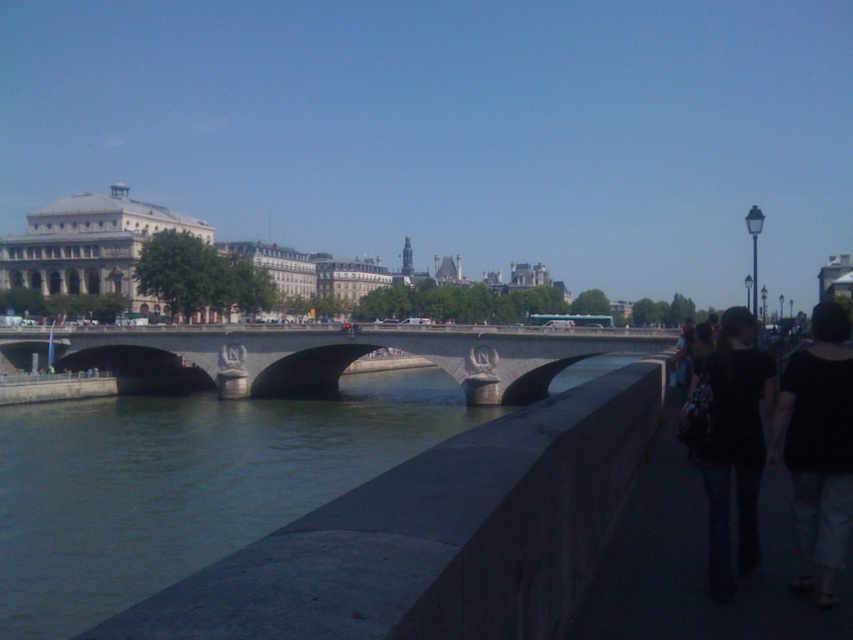
Question: Can you confirm if green stone river at lower left is positioned to the right of black fabric backpack at lower right?

Choices:
 (A) no
 (B) yes

Answer: (A)

Question: Is green stone river at lower left smaller than concrete bridge at center?

Choices:
 (A) no
 (B) yes

Answer: (B)

Question: Which of the following is the farthest from the observer?

Choices:
 (A) (303, 328)
 (B) (442, 388)

Answer: (B)

Question: Which point is closer to the camera taking this photo?

Choices:
 (A) (827, 561)
 (B) (10, 561)
 (C) (471, 365)
 (D) (706, 378)

Answer: (A)

Question: Which point is farther from the camera taking this photo?

Choices:
 (A) (538, 349)
 (B) (776, 541)

Answer: (A)

Question: Where is dark gray concrete sidewalk at lower right located in relation to black fabric backpack at lower right in the image?

Choices:
 (A) right
 (B) left

Answer: (B)